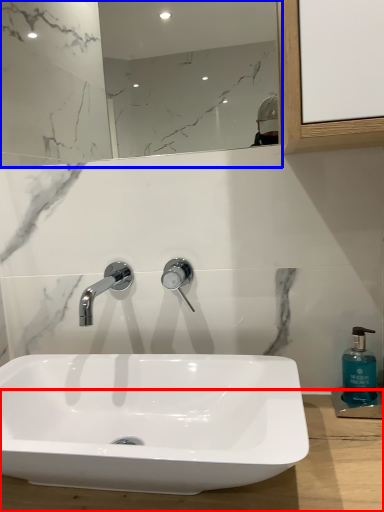
Question: Which object is closer to the camera taking this photo, counter top (highlighted by a red box) or mirror (highlighted by a blue box)?

Choices:
 (A) counter top
 (B) mirror

Answer: (A)